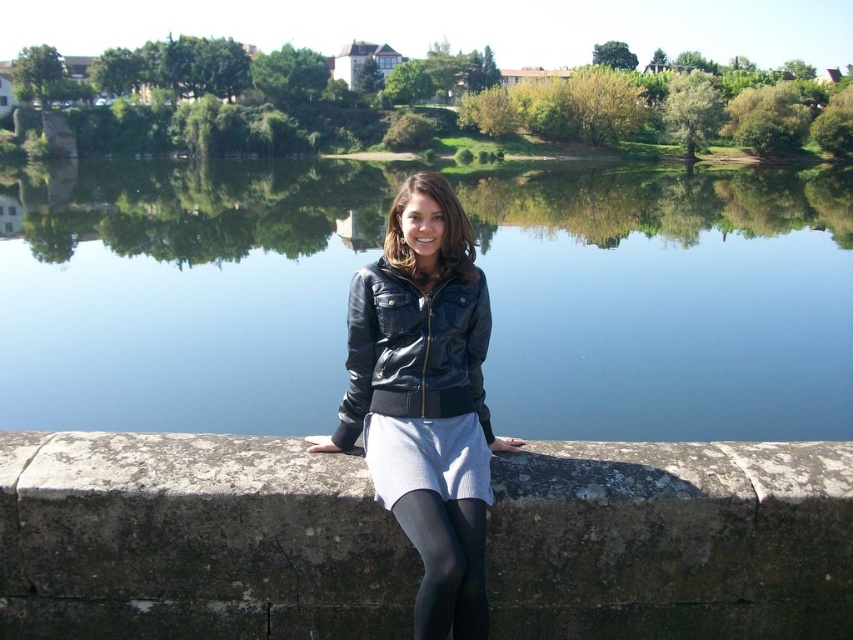
Question: Which object is the closest to the transparent blue water at center?

Choices:
 (A) smooth concrete ledge at center
 (B) black tights at lower center
 (C) leather jacket at center
 (D) black leather jacket at center

Answer: (B)

Question: Estimate the real-world distances between objects in this image. Which object is farther from the black tights at lower center?

Choices:
 (A) smooth concrete ledge at center
 (B) leather jacket at center
 (C) transparent blue water at center
 (D) black leather jacket at center

Answer: (C)

Question: Is transparent blue water at center in front of leather jacket at center?

Choices:
 (A) no
 (B) yes

Answer: (A)

Question: Is smooth concrete ledge at center smaller than leather jacket at center?

Choices:
 (A) yes
 (B) no

Answer: (A)

Question: Among these objects, which one is nearest to the camera?

Choices:
 (A) leather jacket at center
 (B) black leather jacket at center
 (C) smooth concrete ledge at center

Answer: (A)

Question: Is leather jacket at center wider than black leather jacket at center?

Choices:
 (A) yes
 (B) no

Answer: (A)